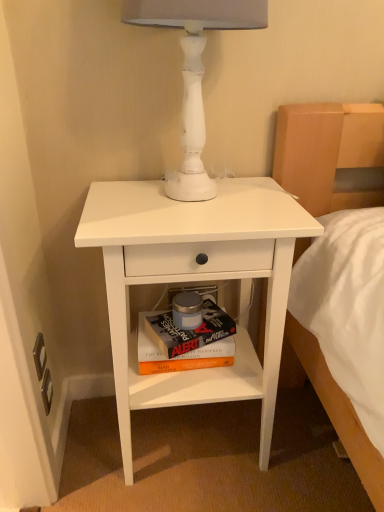
The width and height of the screenshot is (384, 512). What do you see at coordinates (195, 71) in the screenshot?
I see `white matte table lamp at upper center` at bounding box center [195, 71].

This screenshot has height=512, width=384. Identify the location of hardcover book at center. (181, 350).

Between white matte table lamp at upper center and hardcover book at center, which one has smaller width?

hardcover book at center is thinner.

Between point (230, 19) and point (203, 345), which one is positioned in front?

The point (230, 19) is more forward.

From the image's perspective, which one is positioned higher, white matte table lamp at upper center or hardcover book at center?

white matte table lamp at upper center, from the image's perspective.

Could hardcover book at center be considered to be inside white matte table lamp at upper center?

No, white matte table lamp at upper center does not contain hardcover book at center.

Can you confirm if hardcover book at center is bigger than white matte table lamp at upper center?

No.

Can you tell me how much hardcover book at center and white matte table lamp at upper center differ in facing direction?

21.8 degrees.

Does hardcover book at center appear on the left side of white matte table lamp at upper center?

Indeed, hardcover book at center is positioned on the left side of white matte table lamp at upper center.

Which point is more distant from viewer, [171,371] or [194,213]?

Positioned behind is point [171,371].

The image size is (384, 512). There is a hardcover book at center. Find the location of `nightstand above it (from a real-world perspective)`. nightstand above it (from a real-world perspective) is located at coordinates (195, 280).

From a real-world perspective, between hardcover book at center and white matte nightstand at center, who is vertically higher?

In real-world perspective, white matte nightstand at center is above.

Which object is wider, white matte table lamp at upper center or white matte nightstand at center?

Wider between the two is white matte nightstand at center.

From the image's perspective, does white matte table lamp at upper center appear higher than white matte nightstand at center?

Yes, from the image's perspective, white matte table lamp at upper center is above white matte nightstand at center.

Is white matte table lamp at upper center positioned with its back to white matte nightstand at center?

No, white matte table lamp at upper center is not facing away from white matte nightstand at center.

In the scene shown: Can you confirm if white matte table lamp at upper center is positioned to the right of white matte nightstand at center?

Yes, white matte table lamp at upper center is to the right of white matte nightstand at center.

Does white matte nightstand at center lie behind hardcover book at center?

No.

Is white matte nightstand at center positioned with its back to hardcover book at center?

Yes, white matte nightstand at center's orientation is away from hardcover book at center.

Which of these two, white matte nightstand at center or hardcover book at center, is wider?

Wider between the two is white matte nightstand at center.

This screenshot has width=384, height=512. Find the location of `table lamp to the right of white matte nightstand at center`. table lamp to the right of white matte nightstand at center is located at coordinates (195, 71).

Does white matte nightstand at center touch white matte table lamp at upper center?

No, white matte nightstand at center is not beside white matte table lamp at upper center.

From the image's perspective, is white matte nightstand at center below white matte table lamp at upper center?

Correct, white matte nightstand at center appears lower than white matte table lamp at upper center in the image.

From a real-world perspective, is white matte nightstand at center beneath white matte table lamp at upper center?

Yes, from a real-world perspective, white matte nightstand at center is below white matte table lamp at upper center.

I want to click on table lamp in front of the hardcover book at center, so pos(195,71).

Where is `paperback book behind the white matte table lamp at upper center`? paperback book behind the white matte table lamp at upper center is located at coordinates (181, 350).

Which object lies nearer to the anchor point hardcover book at center, white matte nightstand at center or white matte table lamp at upper center?

Among the two, white matte nightstand at center is located nearer to hardcover book at center.

Considering their positions, is hardcover book at center positioned further to white matte nightstand at center than white matte table lamp at upper center?

Based on the image, white matte table lamp at upper center appears to be further to white matte nightstand at center.

From the image, which object appears to be nearer to white matte table lamp at upper center, hardcover book at center or white matte nightstand at center?

white matte nightstand at center is positioned closer to the anchor white matte table lamp at upper center.

Considering their positions, is white matte nightstand at center positioned closer to white matte table lamp at upper center than hardcover book at center?

white matte nightstand at center is positioned closer to the anchor white matte table lamp at upper center.

When comparing their distances from hardcover book at center, does white matte table lamp at upper center or white matte nightstand at center seem closer?

white matte nightstand at center is closer to hardcover book at center.

Looking at the image, which one is located further to white matte nightstand at center, white matte table lamp at upper center or hardcover book at center?

white matte table lamp at upper center lies further to white matte nightstand at center than the other object.

Find the location of a particular element. The width and height of the screenshot is (384, 512). nightstand between white matte table lamp at upper center and hardcover book at center from top to bottom is located at coordinates (195, 280).